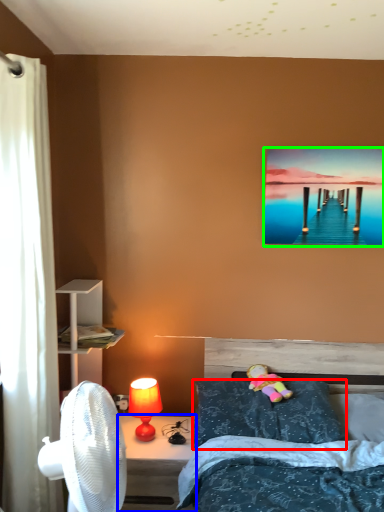
Question: Which is nearer to the pillow (highlighted by a red box)? desk (highlighted by a blue box) or picture frame (highlighted by a green box).

Choices:
 (A) desk
 (B) picture frame

Answer: (A)